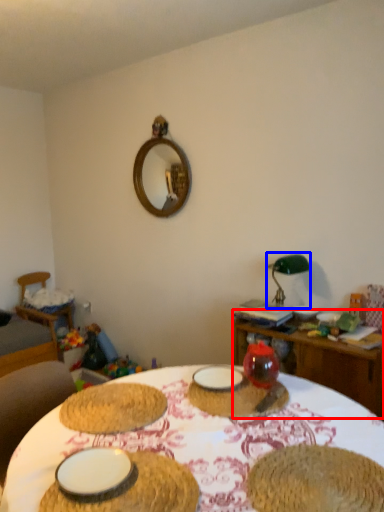
Question: Which object is further to the camera taking this photo, table (highlighted by a red box) or table lamp (highlighted by a blue box)?

Choices:
 (A) table
 (B) table lamp

Answer: (B)